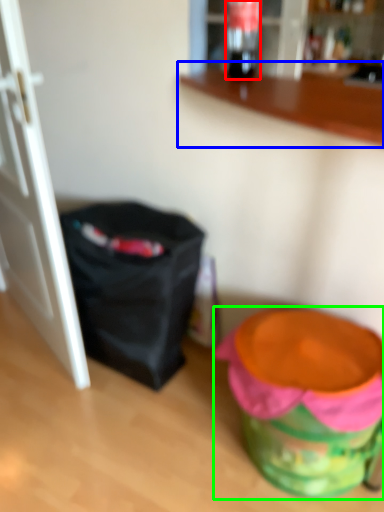
Question: Estimate the real-world distances between objects in this image. Which object is farther from beverage (highlighted by a red box), counter (highlighted by a blue box) or potty (highlighted by a green box)?

Choices:
 (A) counter
 (B) potty

Answer: (B)